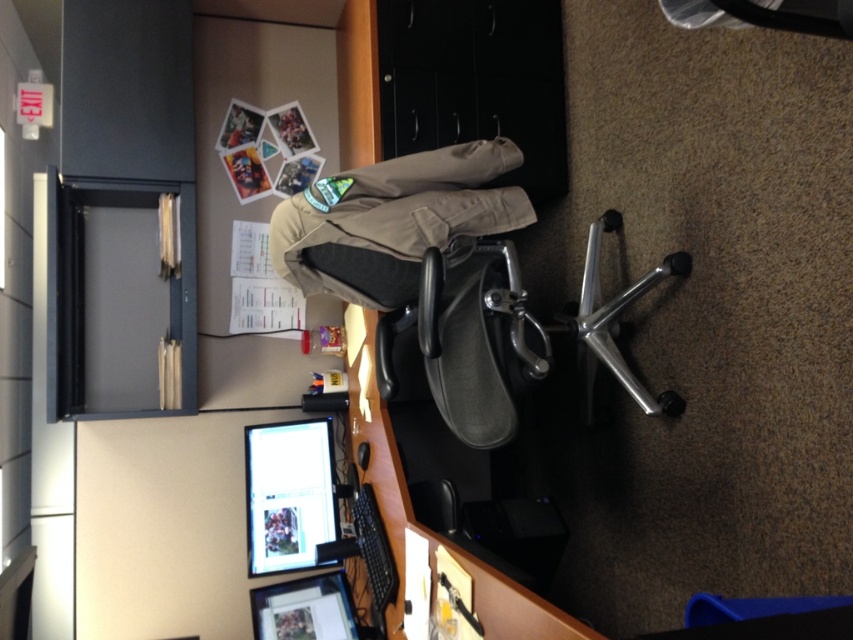
Locate an element on the screen. The height and width of the screenshot is (640, 853). khaki cotton pants at center is located at coordinates (393, 220).

Does khaki cotton pants at center appear on the right side of matte black monitor at lower left?

Correct, you'll find khaki cotton pants at center to the right of matte black monitor at lower left.

Between point (518, 154) and point (260, 426), which one is positioned in front?

Point (518, 154) is in front.

This screenshot has width=853, height=640. Identify the location of khaki cotton pants at center. (393, 220).